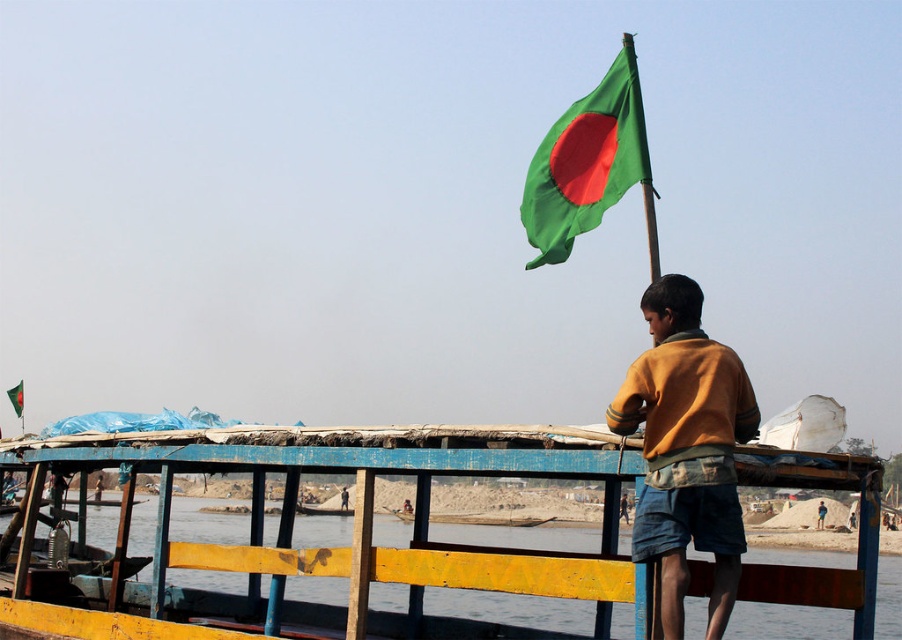
You are a photographer on a boat in Bangladesh. You notice the green fabric flag at upper right and the brown leather jacket at upper right. Which object is wider from your perspective?

The green fabric flag at upper right is wider than the brown leather jacket at upper right from your perspective.

You are a photographer trying to capture the details of the two items at the upper right corner of the boat scene. Which one is taller between the brown leather jacket at upper right and the brown cotton shirt at upper right?

The brown leather jacket at upper right is taller than the brown cotton shirt at upper right.